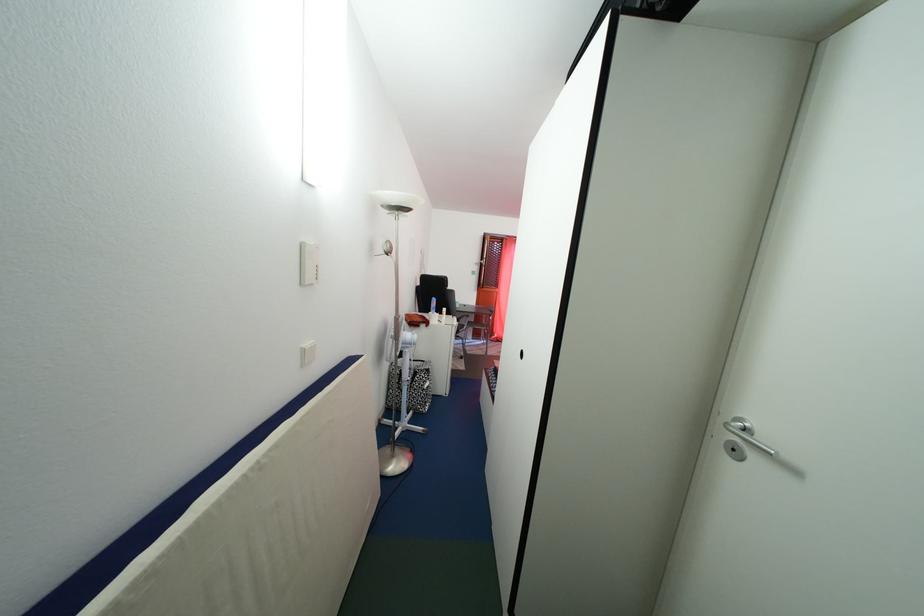
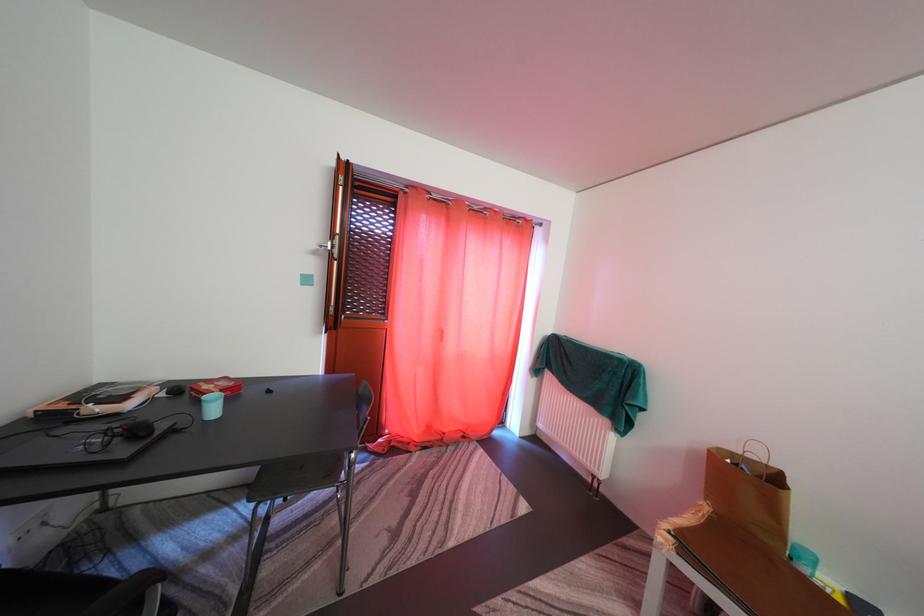
Question: Which direction would the cameraman need to move to produce the second image? Reply with the corresponding letter.

Choices:
 (A) Left
 (B) Right
 (C) Forward
 (D) Backward

Answer: (C)